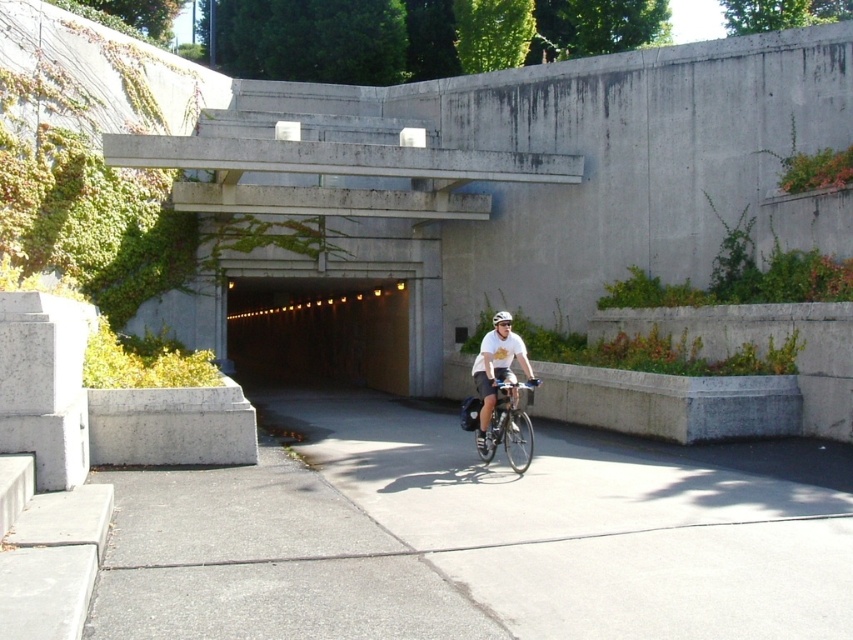
You are a delivery person who needs to load a package onto the silver metallic bicycle at center. The package is 5 feet long. Can you place the package horizontally on the bicycle without it overlapping with the white matte bicycle helmet at center?

The distance between the silver metallic bicycle at center and the white matte bicycle helmet at center is 4.49 feet. Since the package is 5 feet long, it would overlap with the white matte bicycle helmet at center when placed horizontally.

You are standing at the tunnel entrance and want to place two markers on the pavement. The first marker should be at point (495, 404) and the second at point (482, 417). Which marker will be closer to your current position?

The marker at point (495, 404) will be closer to your current position because it is closer to the viewer than point (482, 417).

You are a photographer standing in front of the tunnel entrance. You notice a cyclist wearing a white matte shirt at center and a white matte bicycle helmet at center. Which object is higher up in the image?

The white matte shirt at center is taller than the white matte bicycle helmet at center, so the white matte shirt at center is higher up in the image.